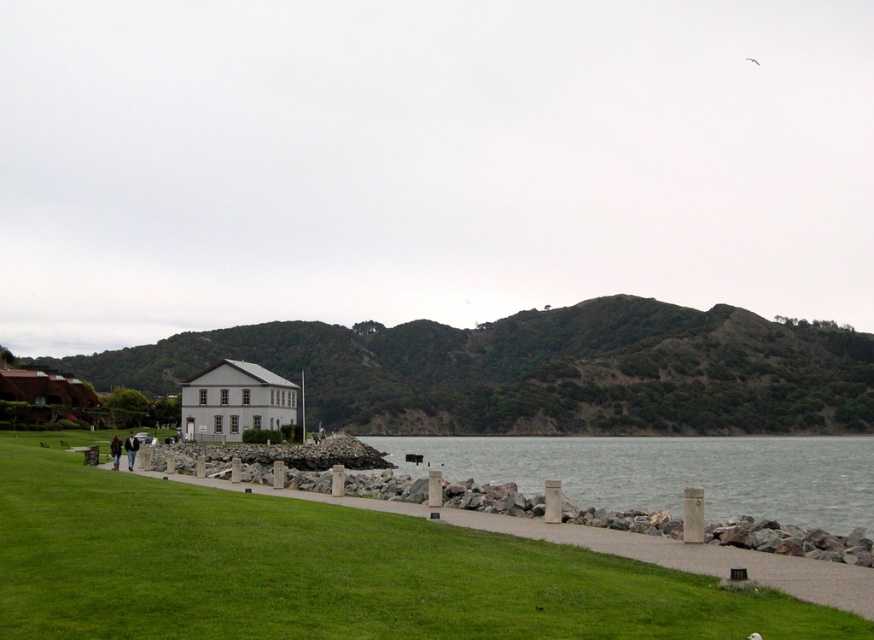
You are standing at the entrance of the white two story building with gray roof and want to take a photo of the green leafy hill at center. Which direction should you face to capture it in your camera?

The green leafy hill at center is located at point [538,371] which is in the center of the image. So you should face towards the center direction to capture it.

You are standing at the lower left corner of the image and want to walk towards the green leafy hill at center. Which direction should you move relative to the green grass at lower left?

You should move to the right relative to the green grass at lower left because the green leafy hill at center is positioned to the right side of the green grass at lower left.